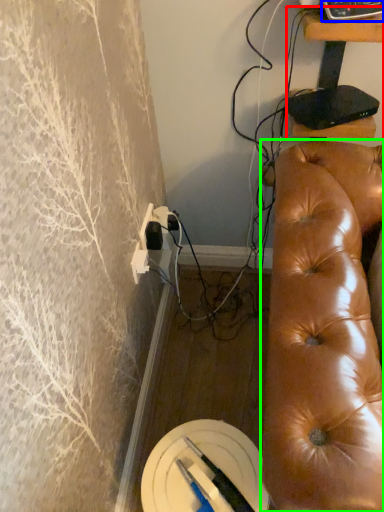
Question: Which object is the closest to the furniture (highlighted by a red box)? Choose among these: equipment (highlighted by a blue box) or studio couch (highlighted by a green box).

Choices:
 (A) equipment
 (B) studio couch

Answer: (A)